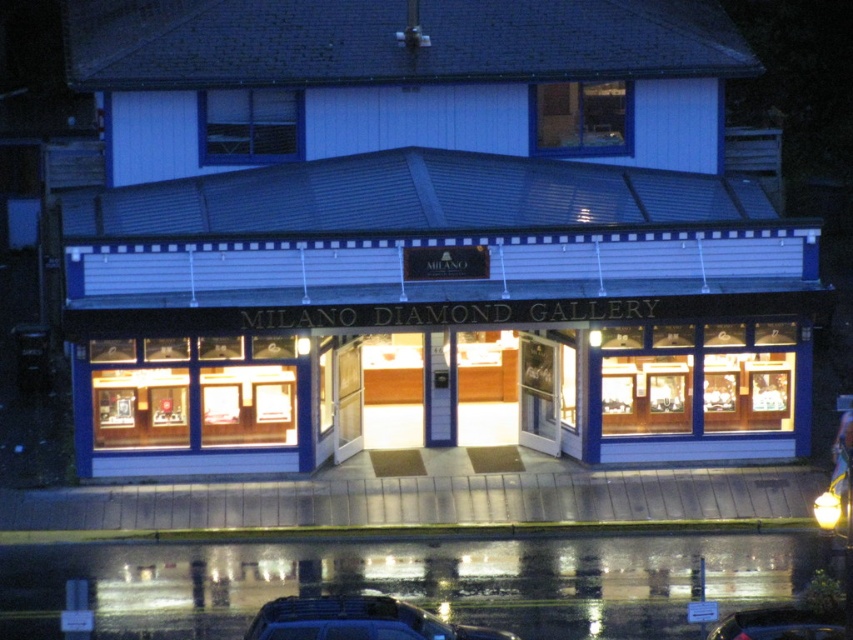
Who is higher up, shiny black car at lower center or shiny black car at lower right?

Positioned higher is shiny black car at lower center.

The width and height of the screenshot is (853, 640). Describe the element at coordinates (357, 620) in the screenshot. I see `shiny black car at lower center` at that location.

At what (x,y) coordinates should I click in order to perform the action: click on shiny black car at lower center. Please return your answer as a coordinate pair (x, y). Looking at the image, I should click on (357, 620).